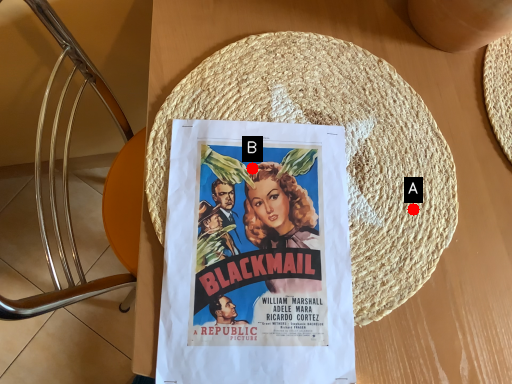
Question: Two points are circled on the image, labeled by A and B beside each circle. Which of the following is the farthest from the observer?

Choices:
 (A) A is further
 (B) B is further

Answer: (A)